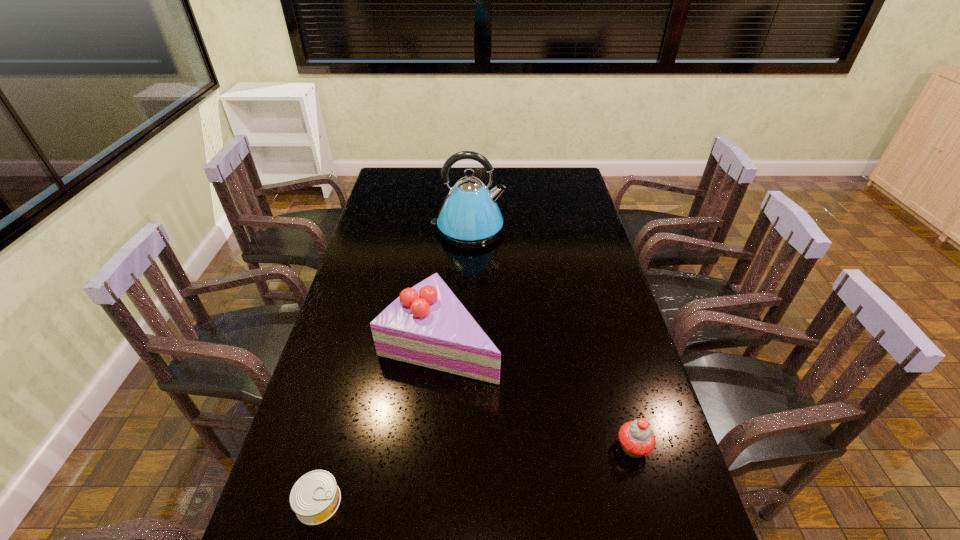
The image size is (960, 540). Identify the location of free point between the second tallest object and the tallest object. (453, 285).

Locate an element on the screen. free space between the third nearest object and the second nearest object is located at coordinates (536, 394).

The height and width of the screenshot is (540, 960). What are the coordinates of `vacant region between the second nearest object and the shortest object` in the screenshot? It's located at (476, 475).

Locate an element on the screen. The image size is (960, 540). free space between the nearest object and the third shortest object is located at coordinates (379, 421).

At what (x,y) coordinates should I click in order to perform the action: click on free point between the tallest object and the can. Please return your answer as a coordinate pair (x, y). Looking at the image, I should click on (394, 366).

Where is `unoccupied area between the cupcake and the tallest object`? The height and width of the screenshot is (540, 960). unoccupied area between the cupcake and the tallest object is located at coordinates (550, 338).

At what (x,y) coordinates should I click in order to perform the action: click on free space between the rightmost object and the second tallest object. Please return your answer as a coordinate pair (x, y). The width and height of the screenshot is (960, 540). Looking at the image, I should click on (536, 394).

Locate an element on the screen. empty space that is in between the third nearest object and the third tallest object is located at coordinates (536, 394).

Identify which object is the closest to the cake. Please provide its 2D coordinates. Your answer should be formatted as a tuple, i.e. [(x, y)], where the tuple contains the x and y coordinates of a point satisfying the conditions above.

[(315, 497)]

Point out which object is positioned as the third nearest to the third farthest object. Please provide its 2D coordinates. Your answer should be formatted as a tuple, i.e. [(x, y)], where the tuple contains the x and y coordinates of a point satisfying the conditions above.

[(469, 215)]